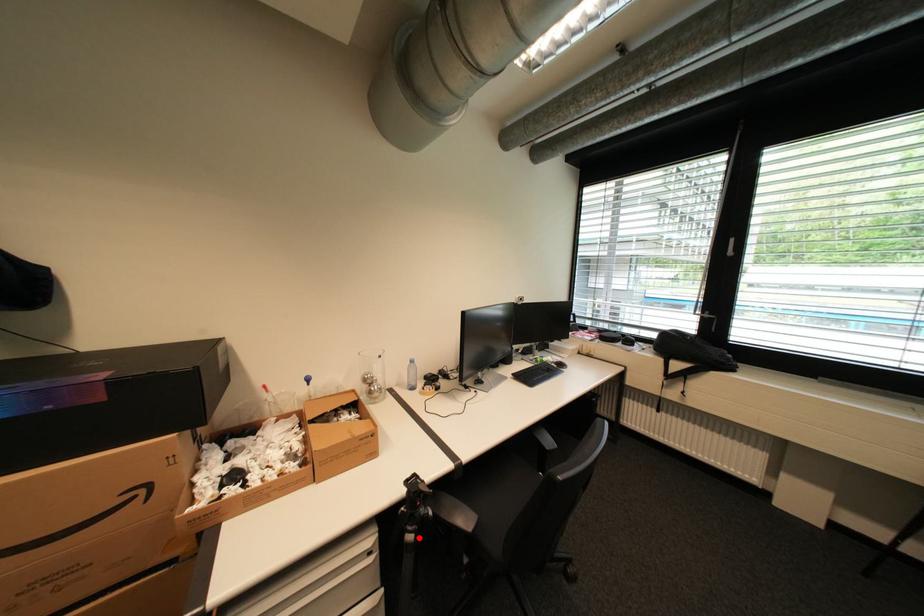
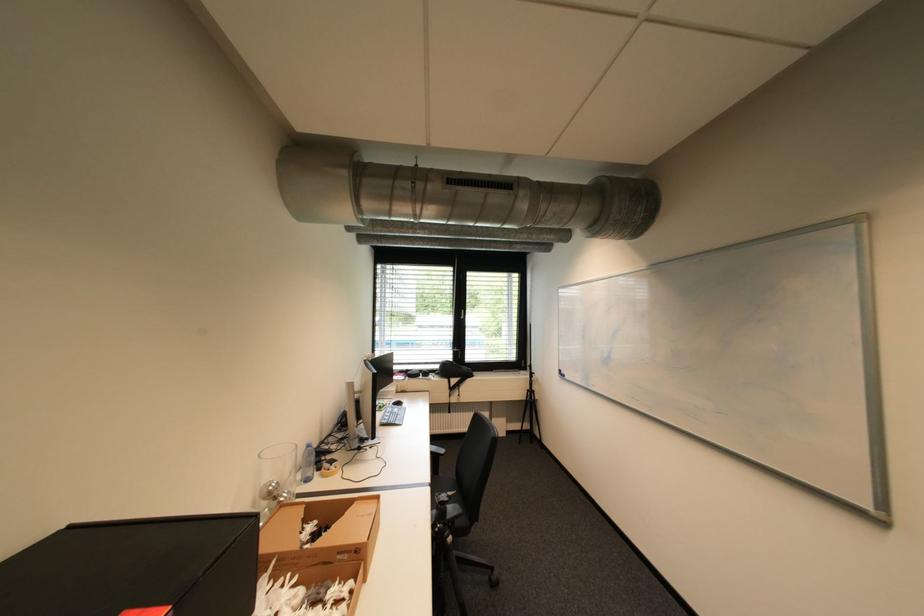
Where in the second image is the point corresponding to the highlighted location from the first image?

(458, 540)